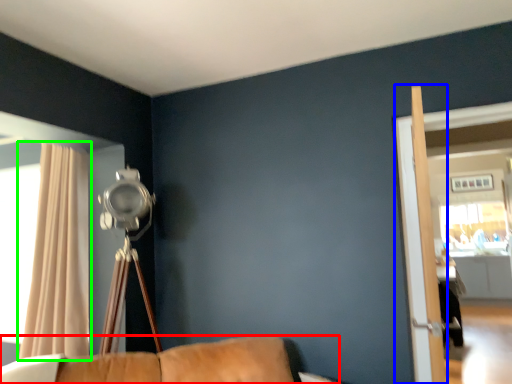
Question: Which object is positioned farthest from furniture (highlighted by a red box)? Select from screen door (highlighted by a blue box) and curtain (highlighted by a green box).

Choices:
 (A) screen door
 (B) curtain

Answer: (A)